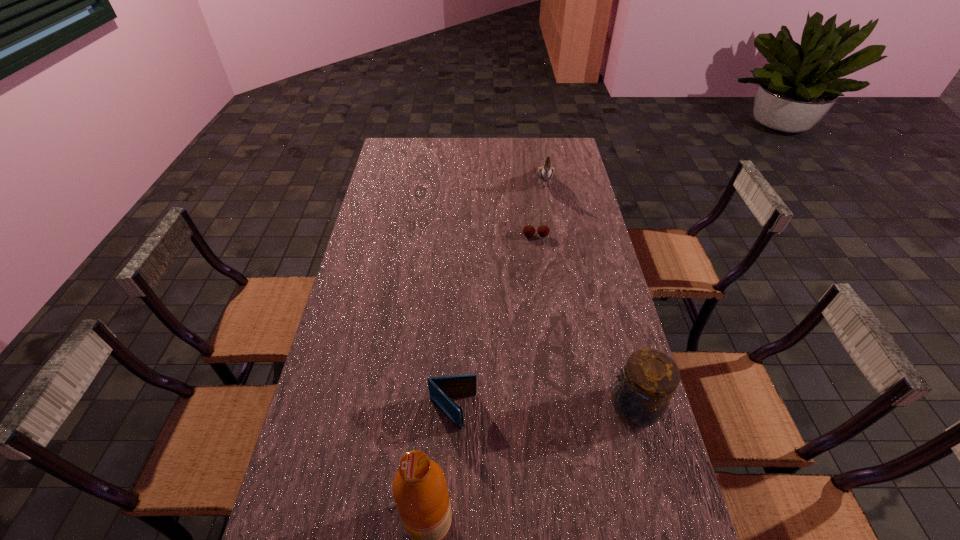
The image size is (960, 540). Find the location of `jar`. jar is located at coordinates (649, 379).

This screenshot has width=960, height=540. I want to click on the fourth nearest object, so click(x=543, y=231).

Locate an element on the screen. the farthest object is located at coordinates (545, 173).

Find the location of a particular element. The height and width of the screenshot is (540, 960). wallet is located at coordinates (442, 389).

This screenshot has height=540, width=960. In order to click on blank area located 0.370m on the lid of the jar in this screenshot , I will do `click(467, 407)`.

At what (x,y) coordinates should I click in order to perform the action: click on free location located 0.400m on the lid of the jar. Please return your answer as a coordinate pair (x, y). Looking at the image, I should click on (455, 407).

This screenshot has width=960, height=540. Identify the location of free space located on the lid of the jar. (467, 407).

Locate an element on the screen. Image resolution: width=960 pixels, height=540 pixels. vacant space located 0.210m on the surface of the fourth nearest object is located at coordinates (537, 281).

At what (x,y) coordinates should I click in order to perform the action: click on vacant space situated on the surface of the fourth nearest object. Please return your answer as a coordinate pair (x, y). Looking at the image, I should click on (538, 318).

Identify the location of free space located on the surface of the fourth nearest object. The height and width of the screenshot is (540, 960). (536, 259).